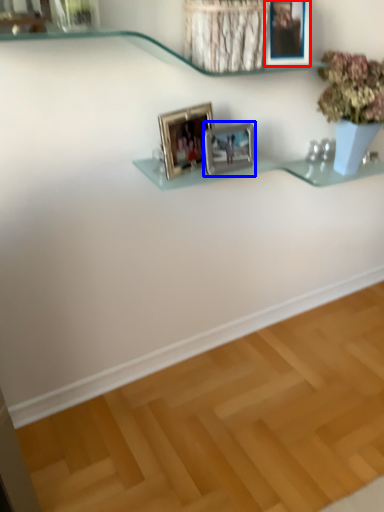
Question: Which object appears closest to the camera in this image, picture frame (highlighted by a red box) or picture frame (highlighted by a blue box)?

Choices:
 (A) picture frame
 (B) picture frame

Answer: (A)